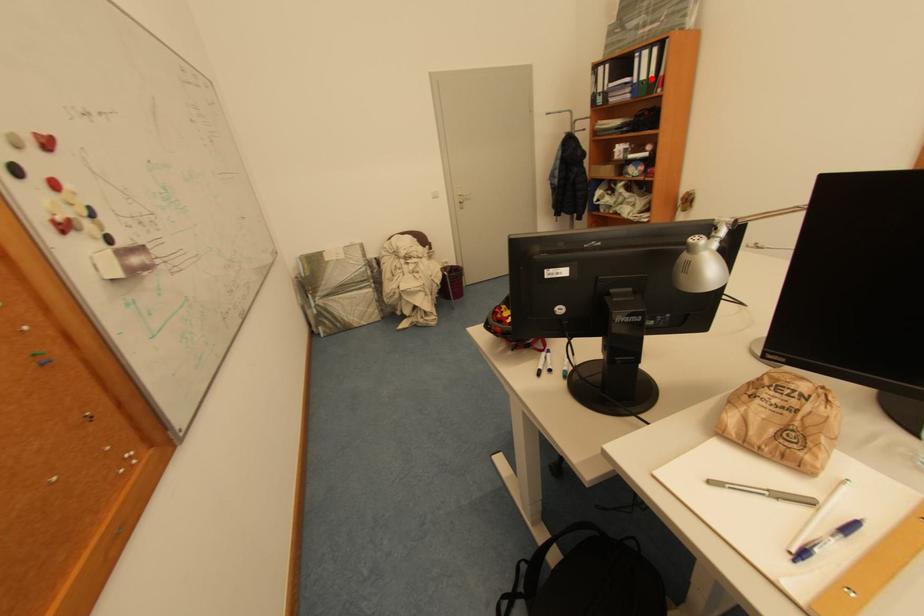
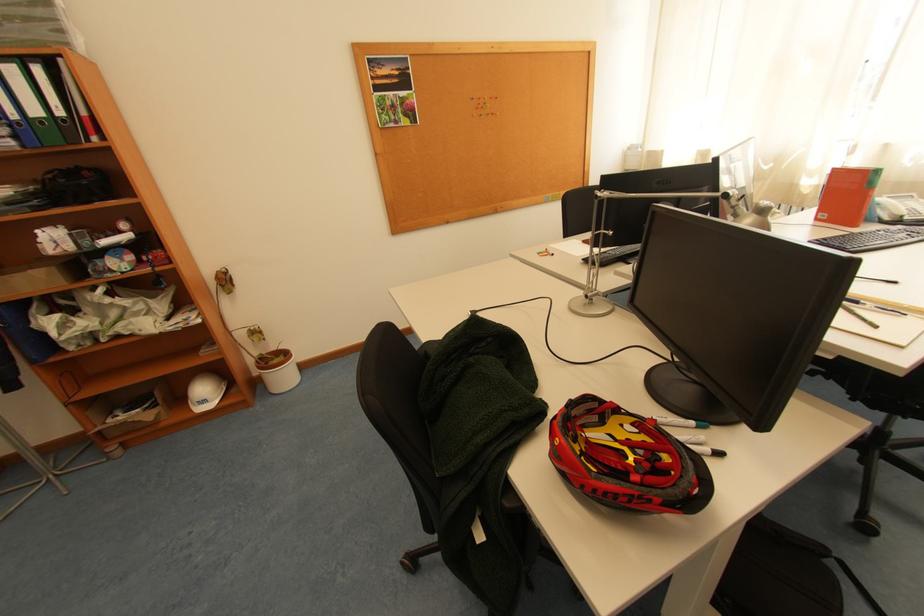
In the second image, find the point that corresponds to the highlighted location in the first image.

(44, 113)